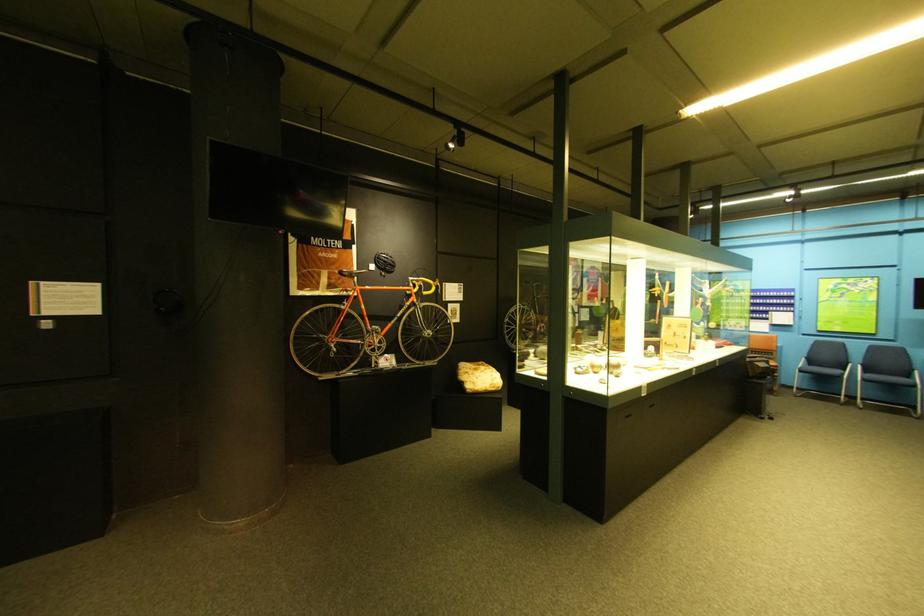
Where is `bicycle pedal`? This screenshot has width=924, height=616. bicycle pedal is located at coordinates (377, 326).